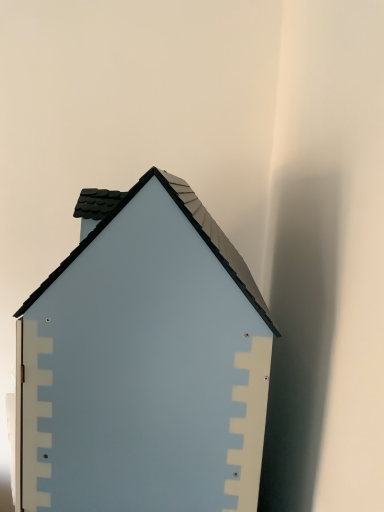
Describe the element at coordinates (144, 362) in the screenshot. I see `matte blue wood house at center` at that location.

This screenshot has height=512, width=384. I want to click on matte blue wood house at center, so click(144, 362).

In order to face matte blue wood house at center, should I rotate leftwards or rightwards?

Rotate your view left by about 5.184°.

Find the location of a particular element. matte blue wood house at center is located at coordinates (144, 362).